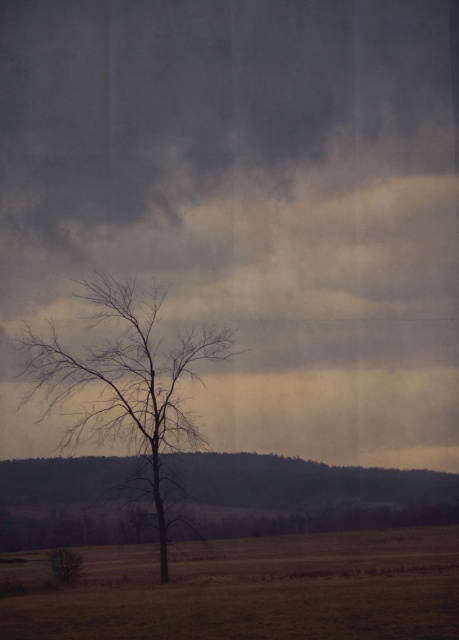
You are a bird looking for a place to land. You see the brown grassland at center and the bare branches at center. Which one is lower to the ground?

The brown grassland at center is lower to the ground than the bare branches at center.